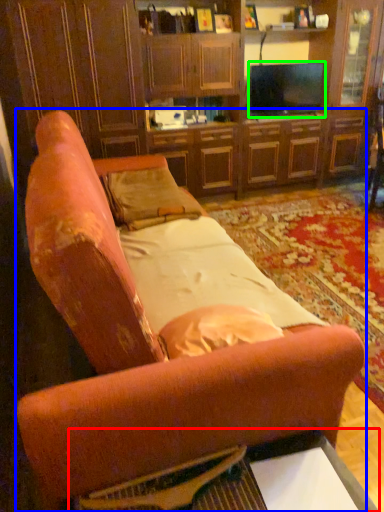
Question: Which object is positioned closest to table (highlighted by a red box)? Select from studio couch (highlighted by a blue box) and television (highlighted by a green box).

Choices:
 (A) studio couch
 (B) television

Answer: (A)